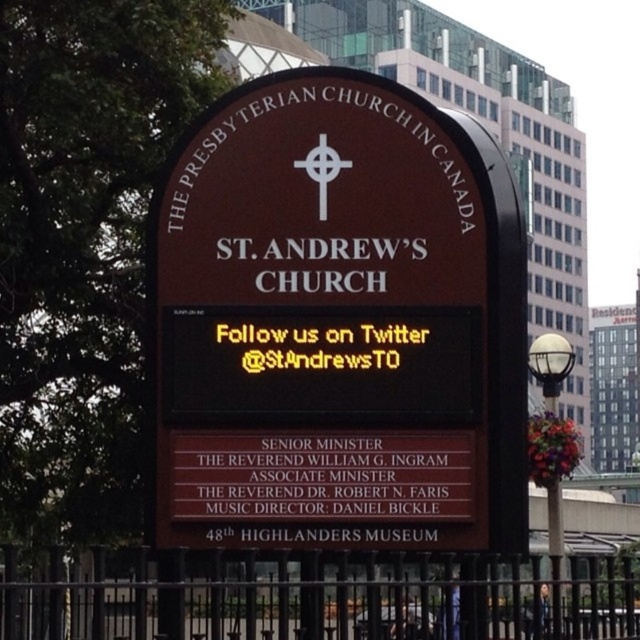
Question: Is brown polished wood sign at center to the left of black metal fence at lower center from the viewer's perspective?

Choices:
 (A) yes
 (B) no

Answer: (B)

Question: Is brown polished wood sign at center above black metal fence at lower center?

Choices:
 (A) yes
 (B) no

Answer: (A)

Question: Is brown polished wood sign at center bigger than black metal fence at lower center?

Choices:
 (A) no
 (B) yes

Answer: (A)

Question: Which object appears closest to the camera in this image?

Choices:
 (A) brown polished wood sign at center
 (B) black metal fence at lower center

Answer: (B)